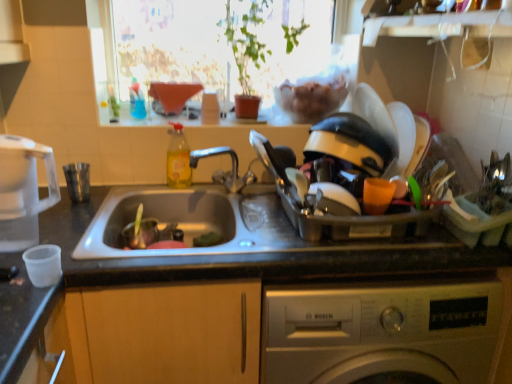
Question: In terms of height, does silver metallic washing machine at lower center look taller or shorter compared to translucent yellow liquid at sink left?

Choices:
 (A) short
 (B) tall

Answer: (B)

Question: Considering the positions of point (331, 288) and point (173, 137), is point (331, 288) closer or farther from the camera than point (173, 137)?

Choices:
 (A) closer
 (B) farther

Answer: (A)

Question: Considering the real-world distances, which object is closest to the metallic gray sink at center?

Choices:
 (A) transparent plastic kettle at left, which ranks as the first appliance in left-to-right order
 (B) transparent glass window at upper center
 (C) shiny plastic dish rack at right, marked as the 2th appliance in a left-to-right arrangement
 (D) silver metallic washing machine at lower center
 (E) translucent yellow liquid at sink left

Answer: (D)

Question: Estimate the real-world distances between objects in this image. Which object is closer to the transparent plastic kettle at left, which ranks as the first appliance in left-to-right order?

Choices:
 (A) silver metallic washing machine at lower center
 (B) transparent glass window at upper center
 (C) metallic gray sink at center
 (D) shiny plastic dish rack at right, the 1th appliance when ordered from right to left
 (E) translucent yellow liquid at sink left

Answer: (C)